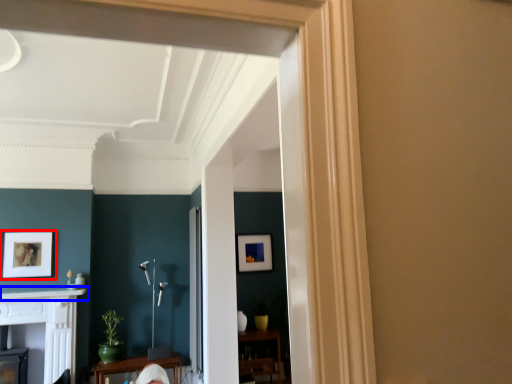
Question: Among these objects, which one is farthest to the camera, picture frame (highlighted by a red box) or mantle (highlighted by a blue box)?

Choices:
 (A) picture frame
 (B) mantle

Answer: (A)